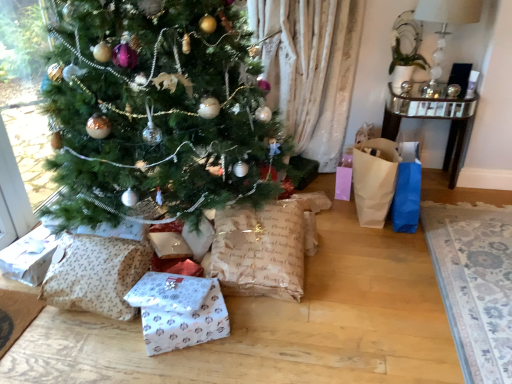
What is the approximate height of burlap paper sack at lower center, the second sack in the left-to-right sequence?

It is 35.71 centimeters.

I want to click on white paper gift at lower center, so click(179, 311).

Where is `patterned paper sack at lower left, the first sack when ordered from left to right`? patterned paper sack at lower left, the first sack when ordered from left to right is located at coordinates (95, 274).

Identify the location of brown paper bag at right. (374, 180).

The height and width of the screenshot is (384, 512). Describe the element at coordinates (446, 23) in the screenshot. I see `white fabric lampshade at upper right` at that location.

At what (x,y) coordinates should I click in order to perform the action: click on green matte christmas tree at center. Please return your answer as a coordinate pair (x, y). This screenshot has height=384, width=512. Looking at the image, I should click on pyautogui.click(x=158, y=112).

Identify the location of burlap paper sack at lower center, the second sack in the left-to-right sequence. (260, 250).

Where is `lamp on the right of white paper gift at lower center`? lamp on the right of white paper gift at lower center is located at coordinates (446, 23).

Is point (190, 310) farther from viewer compared to point (449, 9)?

No, (190, 310) is closer to viewer.

Is white paper gift at lower center wider than white fabric lampshade at upper right?

In fact, white paper gift at lower center might be narrower than white fabric lampshade at upper right.

Is white paper gift at lower center inside the boundaries of white fabric lampshade at upper right, or outside?

white paper gift at lower center is spatially situated outside white fabric lampshade at upper right.

From a real-world perspective, is burlap paper sack at lower center, the second sack in the left-to-right sequence, located beneath patterned paper sack at lower left, the 2th sack in the right-to-left sequence?

No.

Is burlap paper sack at lower center, the second sack in the left-to-right sequence, not close to patterned paper sack at lower left, the 2th sack in the right-to-left sequence?

Actually, burlap paper sack at lower center, the second sack in the left-to-right sequence, and patterned paper sack at lower left, the 2th sack in the right-to-left sequence, are a little close together.

Is point (304, 220) closer to viewer compared to point (122, 272)?

No, it is behind (122, 272).

How far apart are white fabric lampshade at upper right and burlap paper sack at lower center, arranged as the first sack when viewed from the right?

They are 4.81 feet apart.

From the image's perspective, who appears lower, white fabric lampshade at upper right or burlap paper sack at lower center, arranged as the first sack when viewed from the right?

burlap paper sack at lower center, arranged as the first sack when viewed from the right, is shown below in the image.

Between point (440, 40) and point (253, 293), which one is positioned in front?

The point (253, 293) is more forward.

Which of these two, white fabric lampshade at upper right or burlap paper sack at lower center, arranged as the first sack when viewed from the right, stands shorter?

burlap paper sack at lower center, arranged as the first sack when viewed from the right.

In the scene shown: From the image's perspective, is white paper gift at lower center on top of burlap paper sack at lower center, arranged as the first sack when viewed from the right?

No, from the image's perspective, white paper gift at lower center is not over burlap paper sack at lower center, arranged as the first sack when viewed from the right.

In terms of height, does white paper gift at lower center look taller or shorter compared to burlap paper sack at lower center, the second sack in the left-to-right sequence?

Considering their sizes, white paper gift at lower center has less height than burlap paper sack at lower center, the second sack in the left-to-right sequence.

How different are the orientations of white paper gift at lower center and burlap paper sack at lower center, arranged as the first sack when viewed from the right, in degrees?

There is a 66.1-degree angle between the facing directions of white paper gift at lower center and burlap paper sack at lower center, arranged as the first sack when viewed from the right.

This screenshot has width=512, height=384. I want to click on gift wrap that is in front of the burlap paper sack at lower center, the second sack in the left-to-right sequence, so click(x=179, y=311).

Locate an element on the screen. The height and width of the screenshot is (384, 512). the 2nd sack behind the green matte christmas tree at center, counting from the anchor's position is located at coordinates (260, 250).

Is green matte christmas tree at center spatially inside burlap paper sack at lower center, arranged as the first sack when viewed from the right, or outside of it?

green matte christmas tree at center is spatially situated outside burlap paper sack at lower center, arranged as the first sack when viewed from the right.

Considering the relative sizes of green matte christmas tree at center and burlap paper sack at lower center, arranged as the first sack when viewed from the right, in the image provided, is green matte christmas tree at center taller than burlap paper sack at lower center, arranged as the first sack when viewed from the right,?

Correct, green matte christmas tree at center is much taller as burlap paper sack at lower center, arranged as the first sack when viewed from the right.

Can you tell me how much green matte christmas tree at center and burlap paper sack at lower center, the second sack in the left-to-right sequence, differ in facing direction?

The angle between the facing direction of green matte christmas tree at center and the facing direction of burlap paper sack at lower center, the second sack in the left-to-right sequence, is 1.75 degrees.

Considering the sizes of objects patterned paper sack at lower left, the 2th sack in the right-to-left sequence, and brown paper bag at right in the image provided, who is smaller, patterned paper sack at lower left, the 2th sack in the right-to-left sequence, or brown paper bag at right?

With smaller size is patterned paper sack at lower left, the 2th sack in the right-to-left sequence.

Can you confirm if patterned paper sack at lower left, the first sack when ordered from left to right, is positioned to the left of brown paper bag at right?

Yes.

Which object is wider, patterned paper sack at lower left, the first sack when ordered from left to right, or brown paper bag at right?

With larger width is brown paper bag at right.

Looking at their sizes, would you say green matte christmas tree at center is wider or thinner than patterned paper sack at lower left, the 2th sack in the right-to-left sequence?

Clearly, green matte christmas tree at center has more width compared to patterned paper sack at lower left, the 2th sack in the right-to-left sequence.

Does green matte christmas tree at center lie behind patterned paper sack at lower left, the 2th sack in the right-to-left sequence?

That is False.

Who is shorter, green matte christmas tree at center or patterned paper sack at lower left, the first sack when ordered from left to right?

With less height is patterned paper sack at lower left, the first sack when ordered from left to right.

How many degrees apart are the facing directions of green matte christmas tree at center and patterned paper sack at lower left, the 2th sack in the right-to-left sequence?

95.9 degrees.

Where is `gift wrap below the white fabric lampshade at upper right (from a real-world perspective)`? The image size is (512, 384). gift wrap below the white fabric lampshade at upper right (from a real-world perspective) is located at coordinates (179, 311).

Identify the location of sack below the burlap paper sack at lower center, arranged as the first sack when viewed from the right (from the image's perspective). (95, 274).

Considering their positions, is burlap paper sack at lower center, arranged as the first sack when viewed from the right, positioned further to white paper gift at lower center than white fabric lampshade at upper right?

white fabric lampshade at upper right lies further to white paper gift at lower center than the other object.

Considering their positions, is white fabric lampshade at upper right positioned further to green matte christmas tree at center than brown paper bag at right?

The object further to green matte christmas tree at center is white fabric lampshade at upper right.

Based on their spatial positions, is patterned paper sack at lower left, the first sack when ordered from left to right, or burlap paper sack at lower center, the second sack in the left-to-right sequence, closer to brown paper bag at right?

The object closer to brown paper bag at right is burlap paper sack at lower center, the second sack in the left-to-right sequence.

When comparing their distances from white fabric lampshade at upper right, does patterned paper sack at lower left, the 2th sack in the right-to-left sequence, or green matte christmas tree at center seem further?

patterned paper sack at lower left, the 2th sack in the right-to-left sequence.

When comparing their distances from white fabric lampshade at upper right, does green matte christmas tree at center or patterned paper sack at lower left, the first sack when ordered from left to right, seem further?

Among the two, patterned paper sack at lower left, the first sack when ordered from left to right, is located further to white fabric lampshade at upper right.

When comparing their distances from patterned paper sack at lower left, the 2th sack in the right-to-left sequence, does brown paper bag at right or white fabric lampshade at upper right seem closer?

brown paper bag at right lies closer to patterned paper sack at lower left, the 2th sack in the right-to-left sequence, than the other object.

Consider the image. Based on their spatial positions, is brown paper bag at right or patterned paper sack at lower left, the 2th sack in the right-to-left sequence, further from white fabric lampshade at upper right?

Based on the image, patterned paper sack at lower left, the 2th sack in the right-to-left sequence, appears to be further to white fabric lampshade at upper right.

Estimate the real-world distances between objects in this image. Which object is further from burlap paper sack at lower center, arranged as the first sack when viewed from the right, brown paper bag at right or patterned paper sack at lower left, the 2th sack in the right-to-left sequence?

brown paper bag at right is positioned further to the anchor burlap paper sack at lower center, arranged as the first sack when viewed from the right.

I want to click on sack situated between white paper gift at lower center and white fabric lampshade at upper right from left to right, so click(260, 250).

Where is `gift wrap situated between green matte christmas tree at center and white fabric lampshade at upper right from left to right`? The image size is (512, 384). gift wrap situated between green matte christmas tree at center and white fabric lampshade at upper right from left to right is located at coordinates (179, 311).

The width and height of the screenshot is (512, 384). I want to click on sack located between patterned paper sack at lower left, the 2th sack in the right-to-left sequence, and white fabric lampshade at upper right in the left-right direction, so click(x=260, y=250).

At what (x,y) coordinates should I click in order to perform the action: click on gift bag situated between green matte christmas tree at center and white fabric lampshade at upper right from left to right. Please return your answer as a coordinate pair (x, y). This screenshot has width=512, height=384. Looking at the image, I should click on (374, 180).